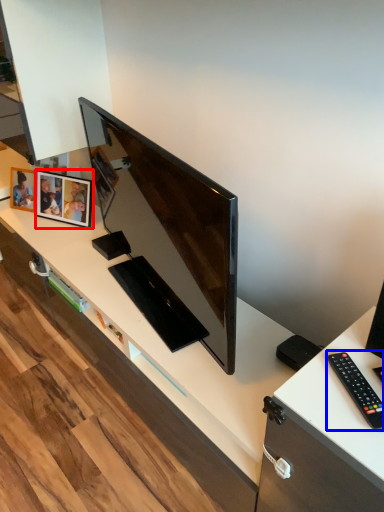
Question: Which object appears closest to the camera in this image, picture frame (highlighted by a red box) or remote control (highlighted by a blue box)?

Choices:
 (A) picture frame
 (B) remote control

Answer: (B)